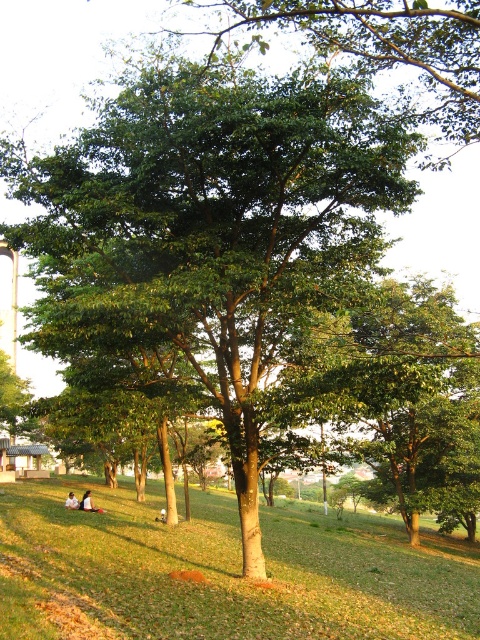
Can you confirm if green leafy tree at center is positioned below green grassy field at center?

Actually, green leafy tree at center is above green grassy field at center.

Is green leafy tree at center bigger than green grassy field at center?

Actually, green leafy tree at center might be smaller than green grassy field at center.

Who is more forward, [181,326] or [135,595]?

Positioned in front is point [135,595].

You are a GUI agent. You are given a task and a screenshot of the screen. Output one action in this format:
    pyautogui.click(x=<x>, y=<y>)
    Task: Click on the green leafy tree at center
    
    Given the screenshot: What is the action you would take?
    click(208, 228)

Is point (115, 579) positioned behind point (72, 497)?

That is False.

You are a GUI agent. You are given a task and a screenshot of the screen. Output one action in this format:
    pyautogui.click(x=<x>, y=<y>)
    Task: Click on the green grassy field at center
    The image size is (480, 640).
    Given the screenshot: What is the action you would take?
    pyautogui.click(x=222, y=570)

Between green grassy field at center and white cotton shirt at center, which one is positioned lower?

green grassy field at center is below.

Who is shorter, green grassy field at center or white cotton shirt at center?

With less height is white cotton shirt at center.

In order to click on green grassy field at center in this screenshot , I will do `click(222, 570)`.